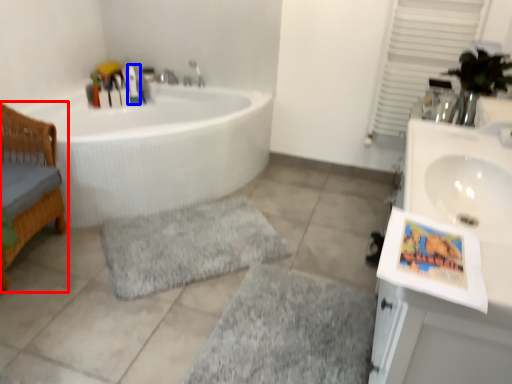
Question: Which of the following is the closest to the observer, furniture (highlighted by a red box) or toiletry (highlighted by a blue box)?

Choices:
 (A) furniture
 (B) toiletry

Answer: (A)